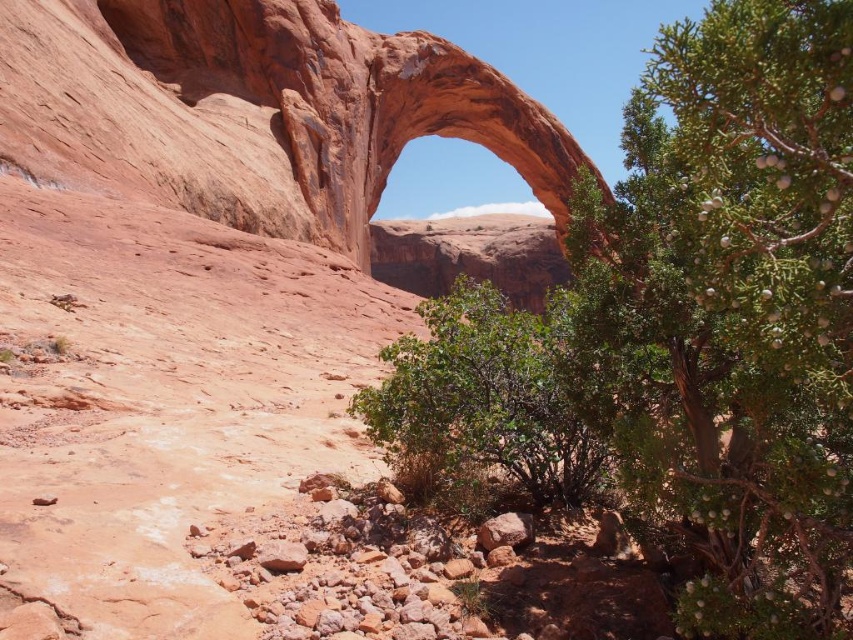
You are standing at the base of the rustic sandstone arch at center and want to take a photo of the green leafy tree at center. Which object should you focus on first to ensure both are in the frame?

Since the green leafy tree at center is shorter than the rustic sandstone arch at center, you should focus on the green leafy tree at center first to ensure the entire tree is visible in the photo while the arch remains in the background.

You are a hiker planning to set up a tent in the area. The green leafy tree at center and the rustic sandstone arch at center are both visible from your proposed tent spot. Which object would cast a longer shadow at sunset if the sun is setting behind the arch?

The rustic sandstone arch at center would cast a longer shadow because it is taller than the green leafy tree at center.